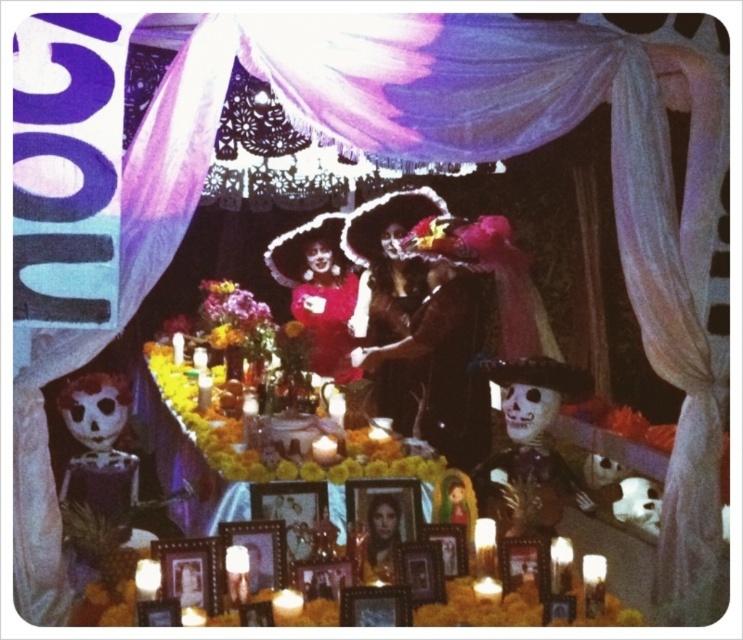
Question: Is matte black dress at center wider than white painted skull at center?

Choices:
 (A) yes
 (B) no

Answer: (A)

Question: Does pink satin dress at center appear over vibrant floral bouquet at center?

Choices:
 (A) yes
 (B) no

Answer: (A)

Question: Which object is the farthest from the white painted skull at center?

Choices:
 (A) vibrant floral bouquet at center
 (B) matte black dress at center

Answer: (A)

Question: Which point is closer to the camera taking this photo?

Choices:
 (A) (369, 554)
 (B) (533, 483)
 (C) (304, 272)

Answer: (A)

Question: Is matte black dress at center bigger than vibrant floral bouquet at center?

Choices:
 (A) yes
 (B) no

Answer: (A)

Question: Which point is closer to the camera?

Choices:
 (A) smooth skin portrait at center
 (B) pink satin dress at center
 (C) matte black dress at center
 (D) white painted skull at center

Answer: (A)